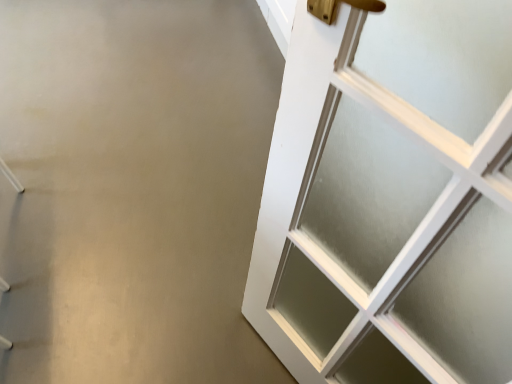
Describe the element at coordinates (390, 198) in the screenshot. The height and width of the screenshot is (384, 512). I see `white frosted glass door at upper right` at that location.

Identify the location of white frosted glass door at upper right. Image resolution: width=512 pixels, height=384 pixels. (390, 198).

Identify the location of white frosted glass door at upper right. [x=390, y=198].